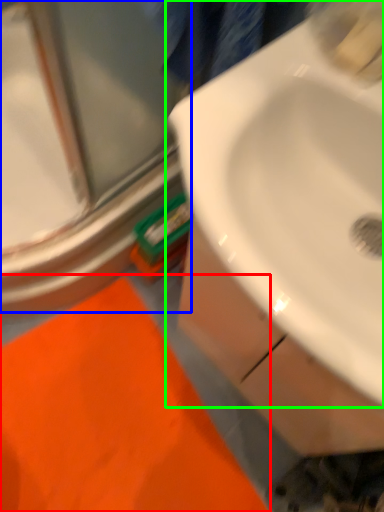
Question: Which object is the farthest from bath mat (highlighted by a red box)? Choose among these: glass door (highlighted by a blue box) or sink (highlighted by a green box).

Choices:
 (A) glass door
 (B) sink

Answer: (B)